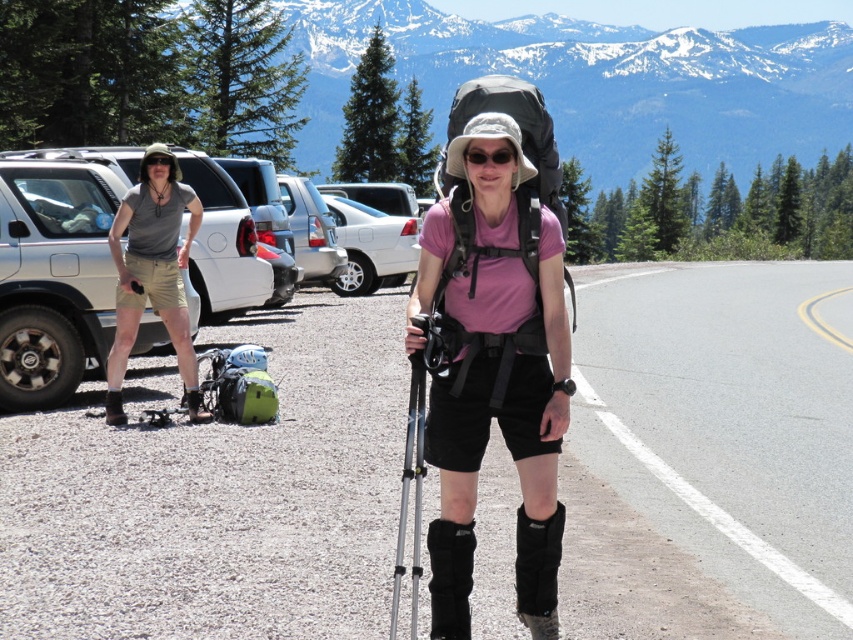
Consider the image. How much distance is there between black synthetic boot at lower center and black matte sunglasses at center?

black synthetic boot at lower center and black matte sunglasses at center are 1.57 meters apart from each other.

Is the position of black synthetic boot at lower center more distant than that of black matte sunglasses at center?

Yes, it is behind black matte sunglasses at center.

The height and width of the screenshot is (640, 853). I want to click on black synthetic boot at lower center, so click(538, 570).

Which is in front, point (190, 404) or point (171, 168)?

Point (171, 168) is more forward.

Does black rubber boot at lower left have a larger size compared to black matte goggles at upper left?

Yes, black rubber boot at lower left is bigger than black matte goggles at upper left.

Is point (184, 392) farther from camera compared to point (155, 161)?

Yes, it is.

Where is `black rubber boot at lower left`? The image size is (853, 640). black rubber boot at lower left is located at coordinates (196, 406).

Can you confirm if silver metallic suv at left is positioned to the left of white matte car at center?

Correct, you'll find silver metallic suv at left to the left of white matte car at center.

Does silver metallic suv at left have a smaller size compared to white matte car at center?

Correct, silver metallic suv at left occupies less space than white matte car at center.

Which is behind, point (235, 276) or point (389, 228)?

Positioned behind is point (389, 228).

Locate an element on the screen. This screenshot has width=853, height=640. silver metallic suv at left is located at coordinates (55, 269).